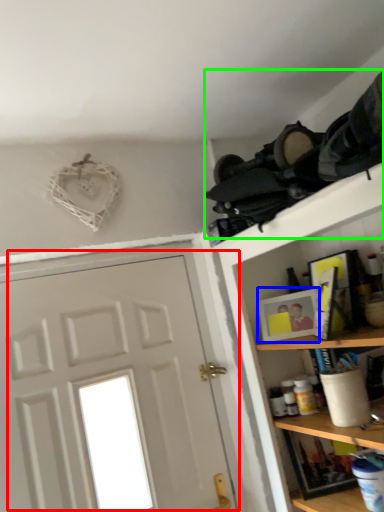
Question: Which object is positioned closest to door (highlighted by a red box)? Select from picture frame (highlighted by a blue box) and laundry (highlighted by a green box).

Choices:
 (A) picture frame
 (B) laundry

Answer: (A)